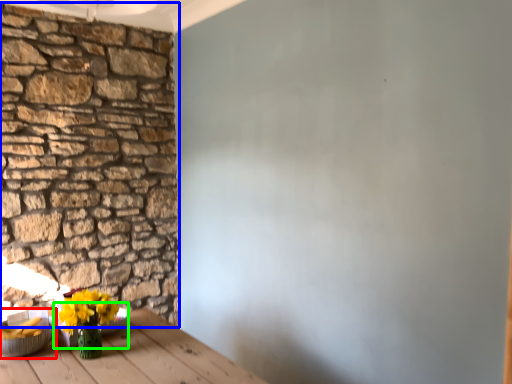
Question: Which object is the farthest from bowl (highlighted by a red box)? Choose among these: brick (highlighted by a blue box) or bowl (highlighted by a green box).

Choices:
 (A) brick
 (B) bowl

Answer: (A)